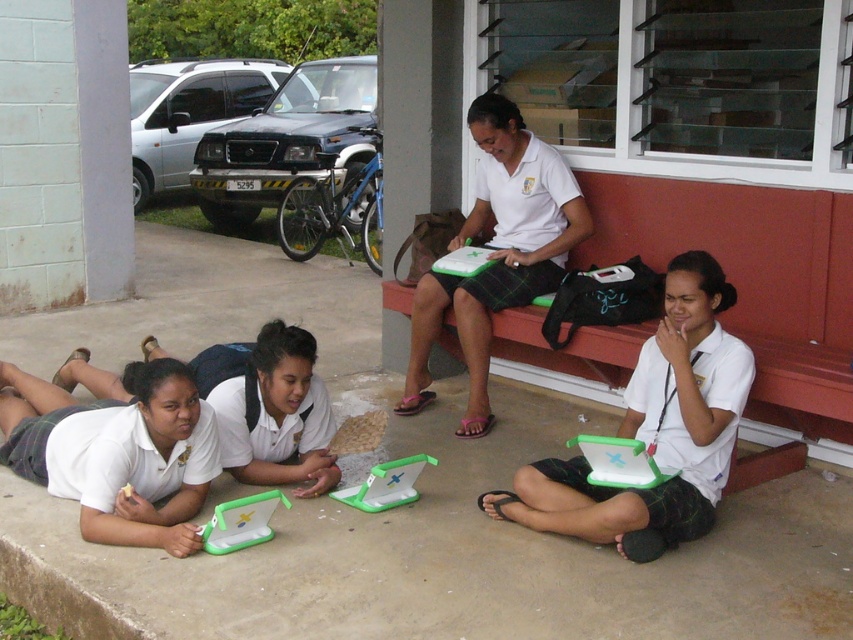
Does matte green plastic laptop at lower left appear under white matte laptop at center?

Indeed, matte green plastic laptop at lower left is positioned under white matte laptop at center.

Does point (163, 493) lie in front of point (427, 326)?

Yes.

The height and width of the screenshot is (640, 853). I want to click on matte green plastic laptop at lower left, so click(115, 452).

Between matte white laptop at center and white matte laptop at center, which one is positioned lower?

Positioned lower is matte white laptop at center.

Who is taller, matte white laptop at center or white matte laptop at center?

Standing taller between the two is white matte laptop at center.

In order to click on matte white laptop at center in this screenshot , I will do `click(654, 429)`.

Which is more to the right, matte white laptop at center or matte green plastic laptop at lower left?

matte white laptop at center

Consider the image. Is the position of matte white laptop at center more distant than that of matte green plastic laptop at lower left?

No, matte white laptop at center is in front of matte green plastic laptop at lower left.

Find the location of a particular element. The width and height of the screenshot is (853, 640). matte white laptop at center is located at coordinates (654, 429).

This screenshot has width=853, height=640. In order to click on matte white laptop at center in this screenshot , I will do `click(654, 429)`.